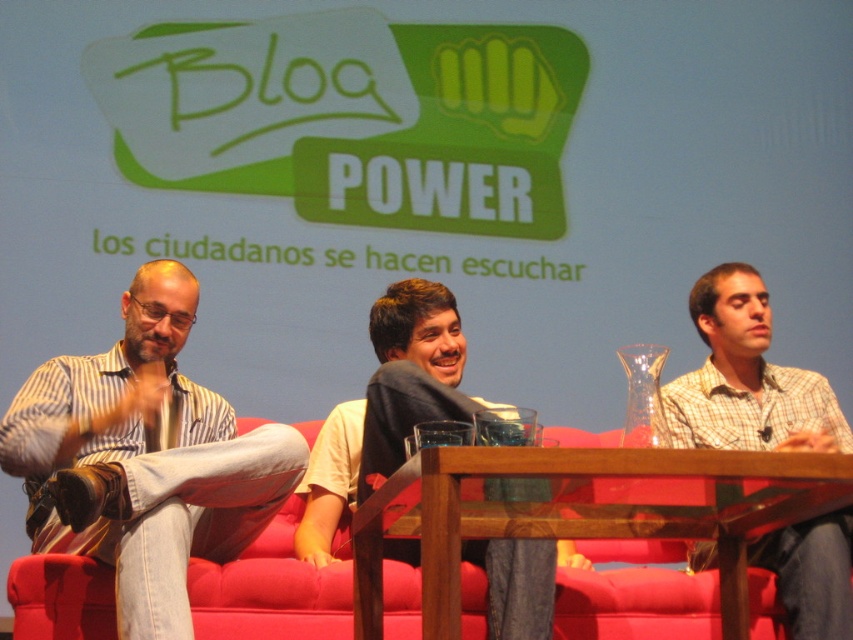
Question: Estimate the real-world distances between objects in this image. Which object is closer to the light brown shirt at center?

Choices:
 (A) striped cotton shirt at left
 (B) plaid shirt at center
 (C) transparent glass table at center

Answer: (B)

Question: Which object is the closest to the plaid shirt at center?

Choices:
 (A) transparent glass table at center
 (B) light brown shirt at center
 (C) striped cotton shirt at left

Answer: (B)

Question: Can you confirm if striped cotton shirt at left is thinner than plaid shirt at center?

Choices:
 (A) no
 (B) yes

Answer: (A)

Question: Considering the real-world distances, which object is closest to the light brown shirt at center?

Choices:
 (A) transparent glass table at center
 (B) plaid shirt at center

Answer: (B)

Question: Does plaid shirt at center have a lesser width compared to light brown shirt at center?

Choices:
 (A) yes
 (B) no

Answer: (B)

Question: Can you confirm if striped cotton shirt at left is positioned above transparent glass table at center?

Choices:
 (A) yes
 (B) no

Answer: (A)